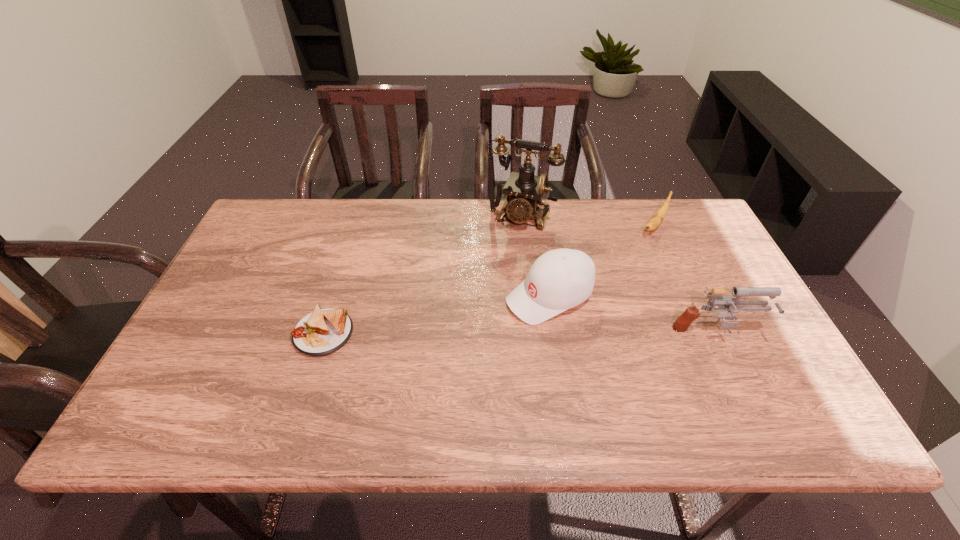
Locate an element on the screen. The image size is (960, 540). free space that satisfies the following two spatial constraints: 1. on the front side of the baseball cap; 2. on the right side of the tallest object is located at coordinates (530, 296).

Find the location of a particular element. blank space that satisfies the following two spatial constraints: 1. on the front side of the gun; 2. at the barrel end of the second shortest object is located at coordinates (703, 334).